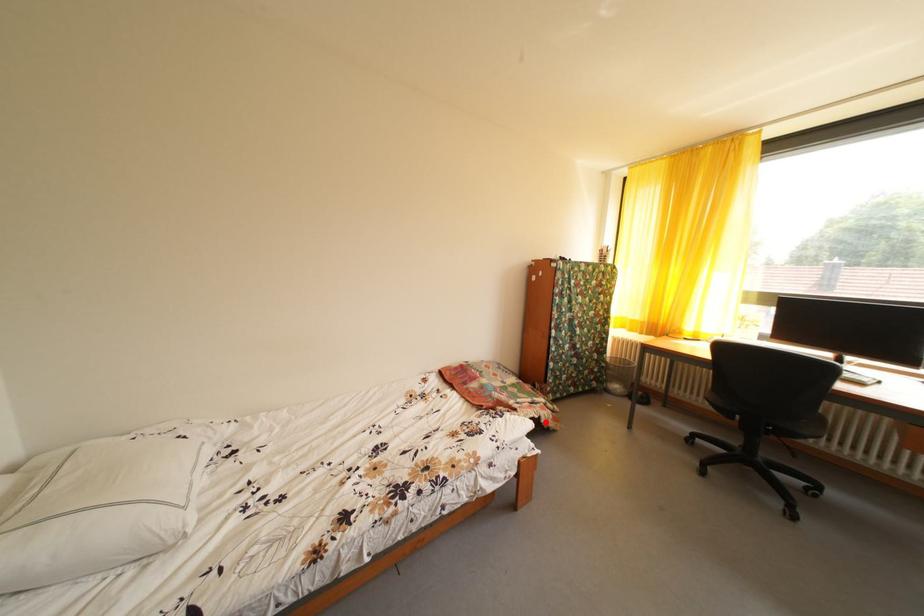
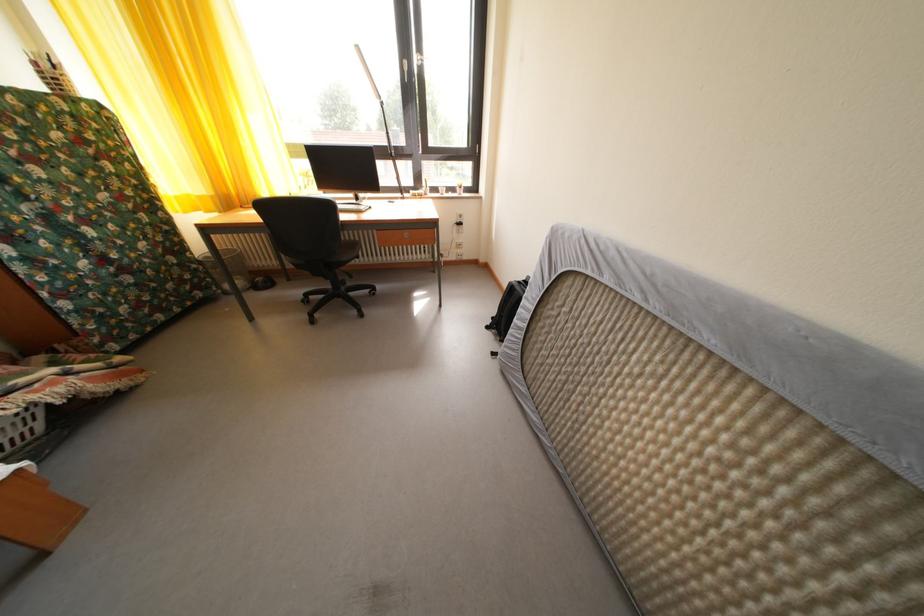
Where in the second image is the point corresponding to the highlighted location from the first image?

(23, 418)